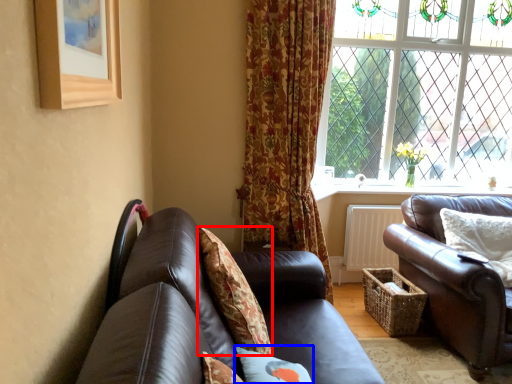
Question: Which point is closer to the camera, pillow (highlighted by a red box) or pillow (highlighted by a blue box)?

Choices:
 (A) pillow
 (B) pillow

Answer: (B)